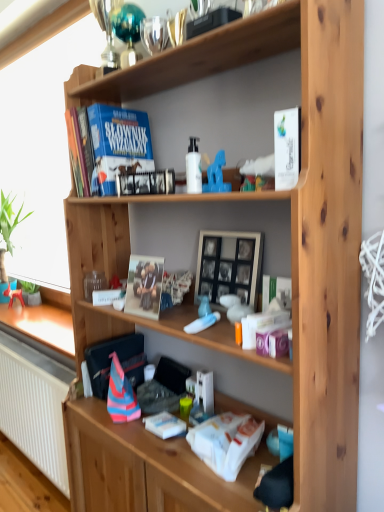
Question: Is hardcover book at upper center, which is the 3th paperback book in front-to-back order, to the right of white glossy bottle at center from the viewer's perspective?

Choices:
 (A) yes
 (B) no

Answer: (B)

Question: Is hardcover book at upper center, the first paperback book in the left-to-right sequence, facing towards white glossy bottle at center?

Choices:
 (A) yes
 (B) no

Answer: (B)

Question: From the image's perspective, is hardcover book at upper center, which is the 1th paperback book in top-to-bottom order, below white glossy bottle at center?

Choices:
 (A) no
 (B) yes

Answer: (A)

Question: Can you confirm if hardcover book at upper center, marked as the first paperback book in a back-to-front arrangement, is thinner than white glossy bottle at center?

Choices:
 (A) yes
 (B) no

Answer: (B)

Question: Is hardcover book at upper center, placed as the third paperback book when sorted from right to left, outside of white glossy bottle at center?

Choices:
 (A) no
 (B) yes

Answer: (B)

Question: Are hardcover book at upper center, which is the 3th paperback book in front-to-back order, and white glossy bottle at center far apart?

Choices:
 (A) yes
 (B) no

Answer: (B)

Question: Could you tell me if white glossy paperback book at upper right, placed as the third paperback book when sorted from back to front, is turned towards green matte plant at lower left?

Choices:
 (A) no
 (B) yes

Answer: (A)

Question: Is white glossy paperback book at upper right, the second paperback book in the top-to-bottom sequence, at the right side of green matte plant at lower left?

Choices:
 (A) yes
 (B) no

Answer: (A)

Question: From a real-world perspective, is white glossy paperback book at upper right, the second paperback book in the top-to-bottom sequence, under green matte plant at lower left?

Choices:
 (A) no
 (B) yes

Answer: (A)

Question: Is white glossy paperback book at upper right, the second paperback book in the top-to-bottom sequence, not close to green matte plant at lower left?

Choices:
 (A) no
 (B) yes

Answer: (B)

Question: From the image's perspective, is white glossy paperback book at upper right, the second paperback book in the top-to-bottom sequence, below green matte plant at lower left?

Choices:
 (A) yes
 (B) no

Answer: (B)

Question: Is white glossy paperback book at upper right, the third paperback book positioned from the left, positioned behind green matte plant at lower left?

Choices:
 (A) no
 (B) yes

Answer: (A)

Question: Does white glossy bottle at center have a lesser width compared to white glossy paperback book at upper right, arranged as the second paperback book when ordered from the bottom?

Choices:
 (A) yes
 (B) no

Answer: (A)